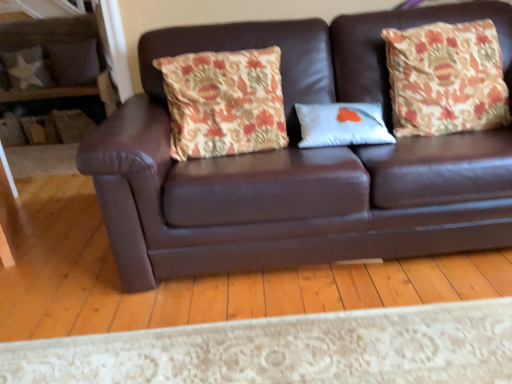
Question: Is floral fabric pillow at right, arranged as the 1th throw pillow when viewed from the right, wider or thinner than floral fabric pillow at upper left, which is the first pillow from top to bottom?

Choices:
 (A) wide
 (B) thin

Answer: (A)

Question: From the image's perspective, is floral fabric pillow at right, arranged as the second throw pillow when viewed from the left, located above or below floral fabric pillow at upper left, which is counted as the 2th pillow, starting from the back?

Choices:
 (A) above
 (B) below

Answer: (B)

Question: Estimate the real-world distances between objects in this image. Which object is closer to the white matte pillow at center, arranged as the 3th pillow when viewed from the top?

Choices:
 (A) floral fabric pillow at upper left, acting as the second pillow starting from the left
 (B) floral fabric pillow at center, which is the first throw pillow in left-to-right order
 (C) brown leather couch at center
 (D) camouflage fabric pillow at upper left, which appears as the second pillow when ordered from the bottom
 (E) floral fabric pillow at right, arranged as the second throw pillow when viewed from the left

Answer: (E)

Question: Which of these objects is positioned farthest from the floral fabric pillow at center, which is the 2th throw pillow from right to left?

Choices:
 (A) floral fabric pillow at upper left, which appears as the third pillow when ordered from the bottom
 (B) camouflage fabric pillow at upper left, the 2th pillow when ordered from top to bottom
 (C) floral fabric pillow at right, arranged as the second throw pillow when viewed from the left
 (D) white matte pillow at center, positioned as the third pillow in back-to-front order
 (E) brown leather couch at center

Answer: (B)